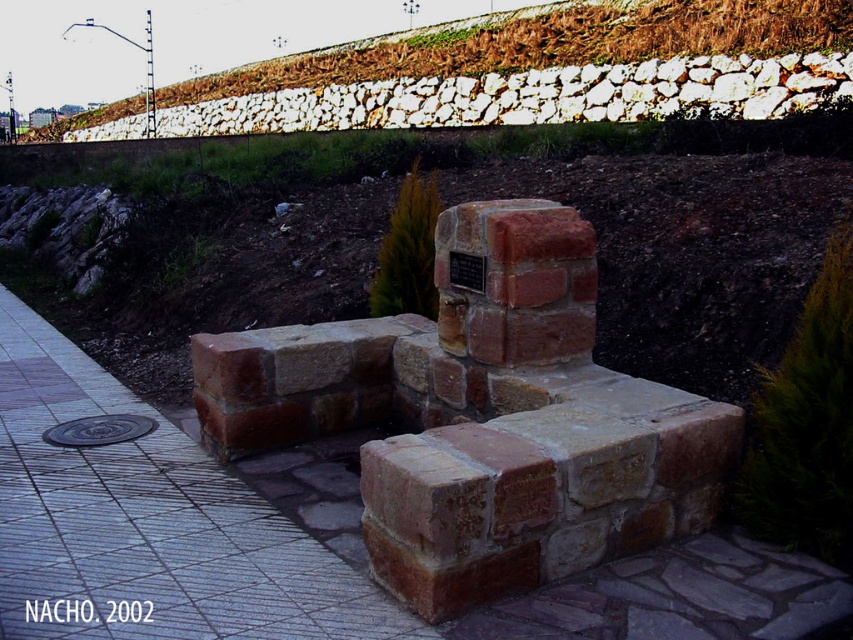
Question: Is brown stone pavement at center positioned behind white stone wall at upper center?

Choices:
 (A) yes
 (B) no

Answer: (B)

Question: Which of the following is the farthest from the observer?

Choices:
 (A) (656, 54)
 (B) (102, 513)

Answer: (A)

Question: Can you confirm if brown stone pavement at center is thinner than white stone wall at upper center?

Choices:
 (A) yes
 (B) no

Answer: (A)

Question: Considering the relative positions of brown stone pavement at center and white stone wall at upper center in the image provided, where is brown stone pavement at center located with respect to white stone wall at upper center?

Choices:
 (A) left
 (B) right

Answer: (B)